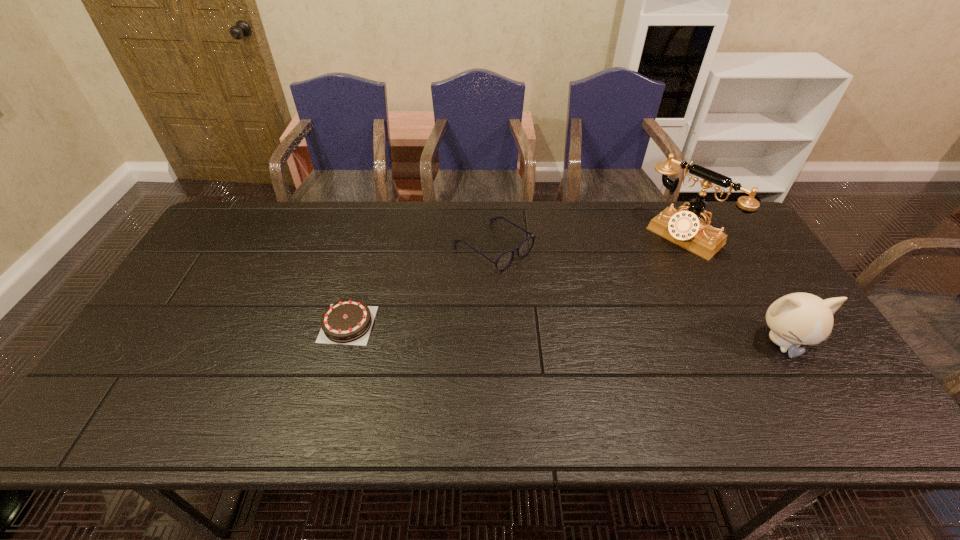
Where is `vacant space located on the front-facing side of the third tallest object`? vacant space located on the front-facing side of the third tallest object is located at coordinates (613, 330).

Identify the location of free space located on the dial of the tallest object. (643, 271).

Locate an element on the screen. The width and height of the screenshot is (960, 540). vacant region located on the dial of the tallest object is located at coordinates (592, 316).

You are a GUI agent. You are given a task and a screenshot of the screen. Output one action in this format:
    pyautogui.click(x=<x>, y=<y>)
    Task: Click on the vacant space located 0.390m on the dial of the tallest object
    The width and height of the screenshot is (960, 540).
    Given the screenshot: What is the action you would take?
    pyautogui.click(x=588, y=320)

This screenshot has width=960, height=540. What are the coordinates of `spectacles present at the far edge` in the screenshot? It's located at (505, 259).

This screenshot has width=960, height=540. In order to click on telephone positioned at the far edge in this screenshot , I will do `click(687, 229)`.

Locate an element on the screen. kitten present at the right edge is located at coordinates (796, 319).

Image resolution: width=960 pixels, height=540 pixels. Identify the location of telephone that is at the right edge. (x=687, y=229).

Find the location of a particular element. The width and height of the screenshot is (960, 540). object situated at the far right corner is located at coordinates (687, 229).

Where is `free space at the far edge of the desktop`? free space at the far edge of the desktop is located at coordinates (264, 238).